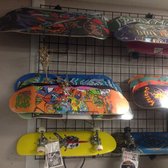
Find the location of a particular element. The height and width of the screenshot is (168, 168). rack is located at coordinates (112, 128).